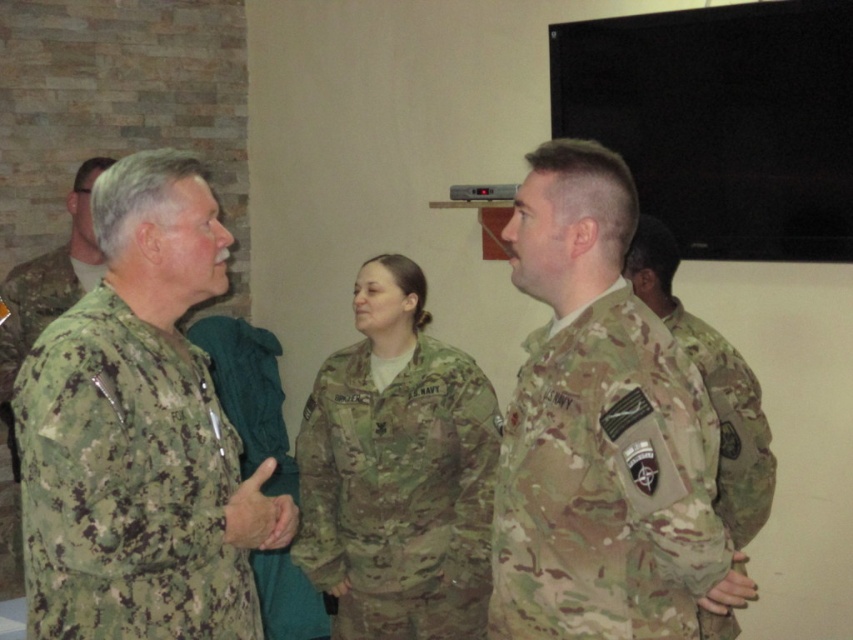
You are a tailor who needs to determine which uniform requires more fabric to make between the camouflage uniform at right and the camouflage fabric uniform at right. Based on the description provided, which one would need more fabric?

The camouflage uniform at right requires more fabric because its width is larger than that of the camouflage fabric uniform at right.

You are a photographer in the room and want to take a photo of both the camouflage uniform at right and the camouflage fabric uniform at right. Which one should you focus on first if you want to capture the taller one?

The camouflage fabric uniform at right is taller than the camouflage uniform at right, so you should focus on the camouflage fabric uniform at right first.

You are a tailor measuring uniforms for a military unit. You need to determine which uniform requires more fabric based on their widths. Which one needs more fabric, the camouflage uniform at center or the camouflage fabric uniform at right?

The camouflage uniform at center requires more fabric because its width surpasses that of the camouflage fabric uniform at right.